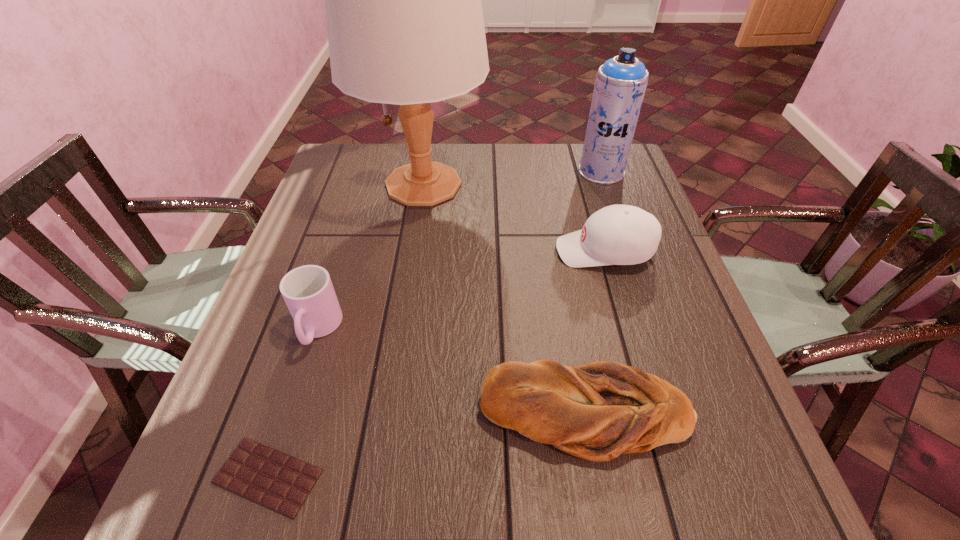
Where is `chocolate bar at the left edge`? This screenshot has height=540, width=960. chocolate bar at the left edge is located at coordinates (278, 481).

Locate an element on the screen. This screenshot has width=960, height=540. aerosol can located at the right edge is located at coordinates (620, 84).

The image size is (960, 540). Identify the location of baseball cap situated at the right edge. (617, 234).

The image size is (960, 540). I want to click on bread located at the right edge, so click(596, 411).

Identify the location of object at the far left corner. Image resolution: width=960 pixels, height=540 pixels. (405, 25).

Find the location of a particular element. The width and height of the screenshot is (960, 540). object that is positioned at the near left corner is located at coordinates coord(278,481).

This screenshot has height=540, width=960. Identify the location of object that is at the far right corner. (620, 84).

Identify the location of object that is at the near right corner. click(596, 411).

Where is `free region at the far edge of the desktop`? The image size is (960, 540). free region at the far edge of the desktop is located at coordinates (504, 173).

Locate an element on the screen. The image size is (960, 540). vacant point at the left edge is located at coordinates (346, 281).